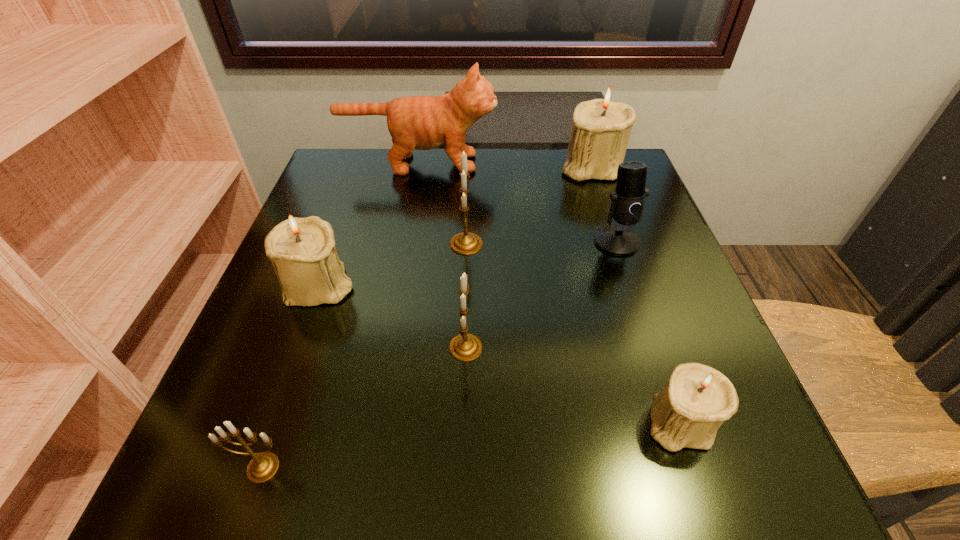
Identify the location of gold candelabrum that is the closest to the leftmost gold candelabrum. This screenshot has height=540, width=960. (465, 347).

The width and height of the screenshot is (960, 540). I want to click on the second closest gold candelabrum relative to the second biggest beige candle_holder, so click(x=465, y=347).

Find the location of a particular element. The image size is (960, 540). vacant region that satisfies the following two spatial constraints: 1. on the face of the farthest beige candle_holder; 2. on the left side of the ginger cat is located at coordinates (419, 166).

In order to click on blank space that satisfies the following two spatial constraints: 1. on the face of the cat; 2. on the left side of the fourth farthest candelabrum in this screenshot , I will do `click(385, 347)`.

Locate an element on the screen. The width and height of the screenshot is (960, 540). vacant region that satisfies the following two spatial constraints: 1. on the face of the ginger cat; 2. on the left side of the second biggest gold candelabrum is located at coordinates tap(385, 347).

Locate an element on the screen. This screenshot has width=960, height=540. vacant space that satisfies the following two spatial constraints: 1. on the back side of the biggest beige candle_holder; 2. on the left side of the biggest gold candelabrum is located at coordinates (468, 166).

Where is `free location that satisfies the following two spatial constraints: 1. on the face of the smallest beige candle_holder; 2. on the left side of the cat`? The height and width of the screenshot is (540, 960). free location that satisfies the following two spatial constraints: 1. on the face of the smallest beige candle_holder; 2. on the left side of the cat is located at coordinates (371, 421).